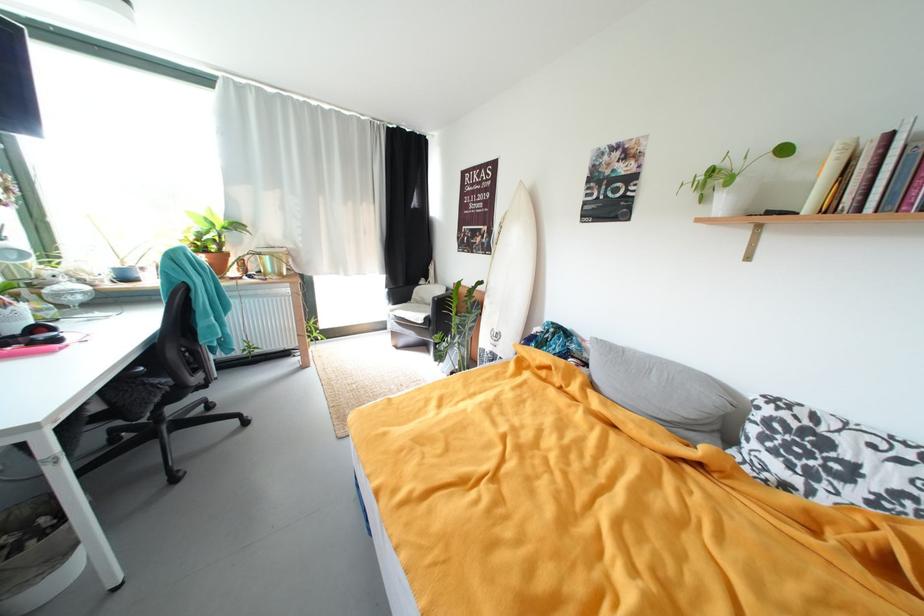
Locate an element on the screen. This screenshot has width=924, height=616. glass jar is located at coordinates (272, 261).